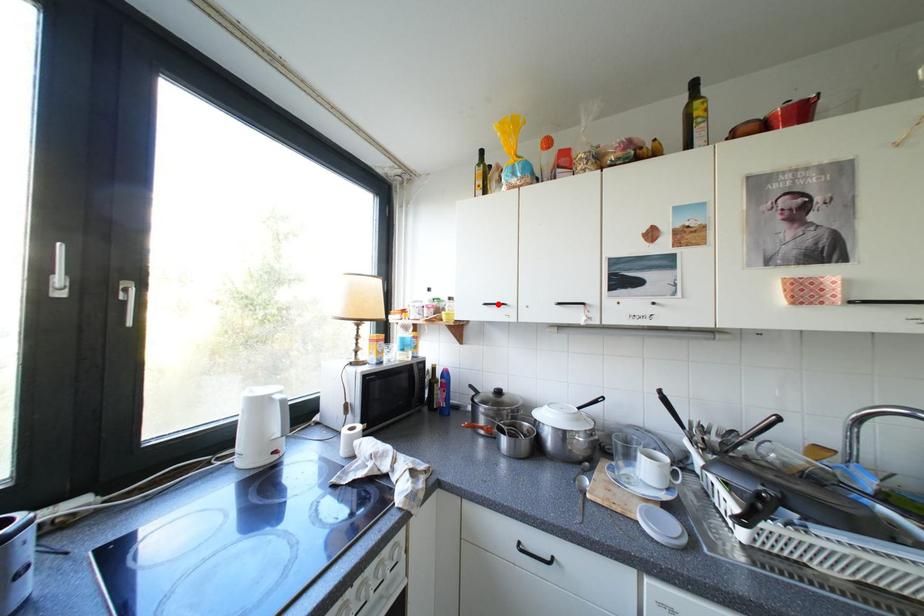
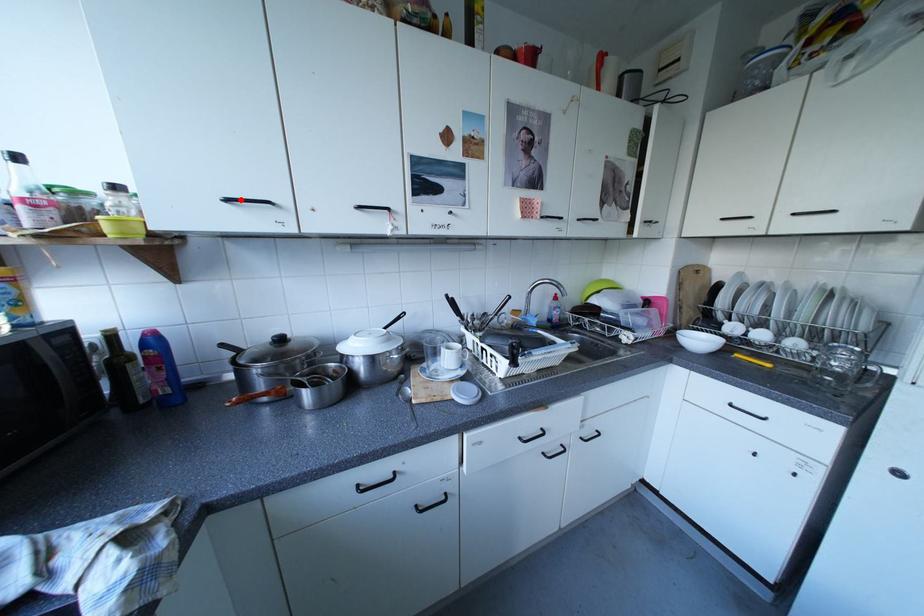
I am providing you with two images of the same scene from different viewpoints. A red point is marked on the first image and another point is marked on the second image. Do the highlighted points in image1 and image2 indicate the same real-world spot?

Yes